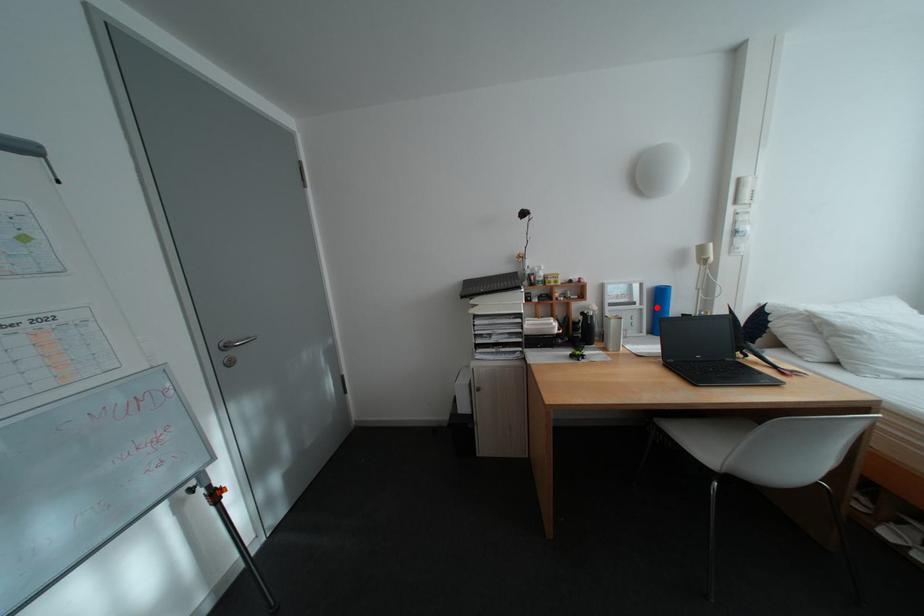
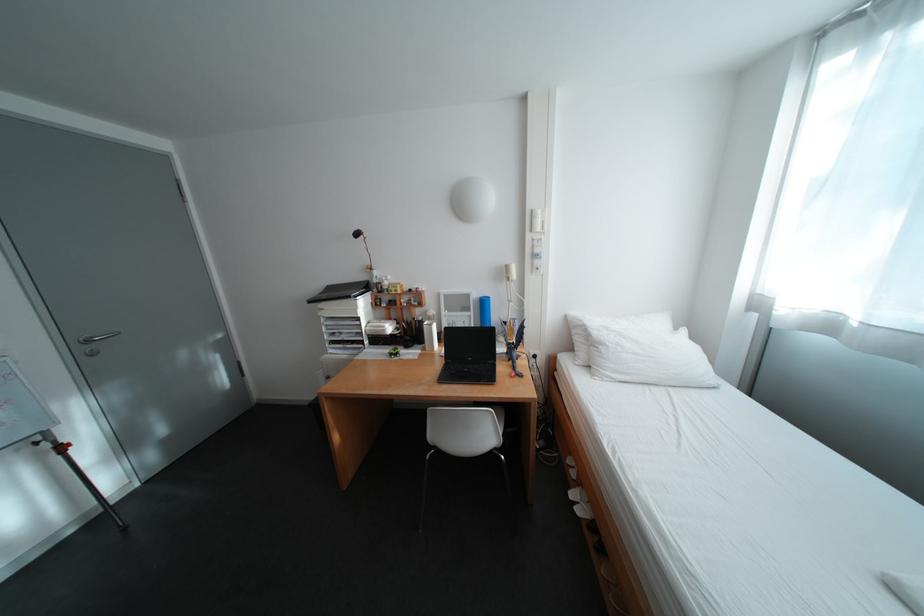
The point at the highlighted location is marked in the first image. Where is the corresponding point in the second image?

(484, 314)